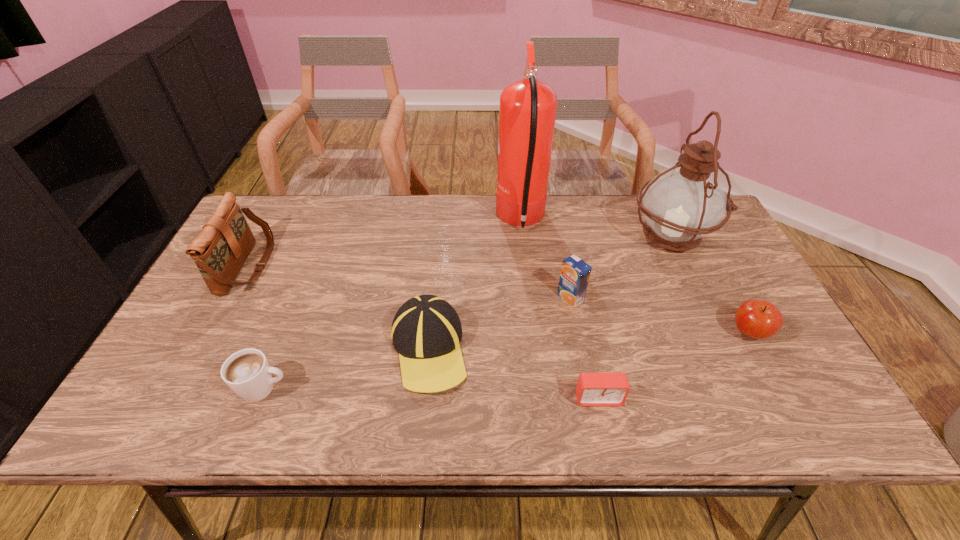
Locate an element on the screen. The image size is (960, 540). free point at the near edge is located at coordinates (240, 423).

Where is `vacant space at the left edge`? Image resolution: width=960 pixels, height=540 pixels. vacant space at the left edge is located at coordinates (209, 382).

In the image, there is a desktop. What are the coordinates of `vacant space at the right edge` in the screenshot? It's located at (780, 385).

The image size is (960, 540). In order to click on free space between the alarm clock and the apple in this screenshot , I will do pyautogui.click(x=674, y=365).

Where is `free space between the fire extinguisher and the apple`? The image size is (960, 540). free space between the fire extinguisher and the apple is located at coordinates (635, 276).

In order to click on free space between the apple and the fire extinguisher in this screenshot , I will do `click(635, 276)`.

You are a GUI agent. You are given a task and a screenshot of the screen. Output one action in this format:
    pyautogui.click(x=<x>, y=<y>)
    Task: Click on the free spot between the orange_juice and the shortest object
    The width and height of the screenshot is (960, 540).
    Given the screenshot: What is the action you would take?
    pyautogui.click(x=584, y=348)

This screenshot has width=960, height=540. I want to click on free spot between the shortest object and the sixth object from right to left, so click(x=514, y=373).

The image size is (960, 540). Identify the location of free space between the fire extinguisher and the apple. (635, 276).

Where is `vacant space in between the baseball cap and the cappuccino`? vacant space in between the baseball cap and the cappuccino is located at coordinates (347, 369).